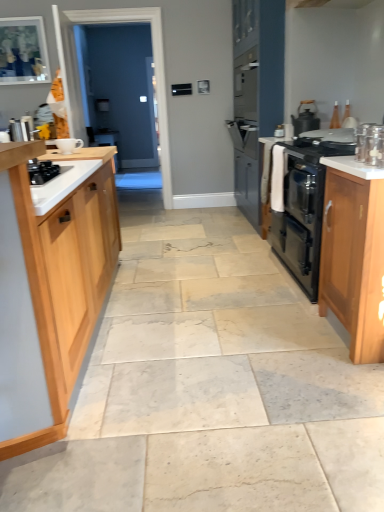
What do you see at coordinates (353, 167) in the screenshot? I see `white glossy countertop at right` at bounding box center [353, 167].

I want to click on white glossy countertop at right, so click(x=353, y=167).

The width and height of the screenshot is (384, 512). Identify the location of white ceramic cup at upper left, which appears as the first appliance when ordered from the bottom. (66, 145).

The width and height of the screenshot is (384, 512). Find the location of `black matte oven at right`. black matte oven at right is located at coordinates (334, 232).

Describe the element at coordinates (353, 256) in the screenshot. I see `light wood cabinet at right, which ranks as the 1th cabinetry in right-to-left order` at that location.

The width and height of the screenshot is (384, 512). In order to click on white glossy countertop at right in this screenshot , I will do `click(353, 167)`.

Is clear glass jar at upper right, marked as the first kitchen appliance in a front-to-back arrangement, facing towards light wood cabinet at right, which ranks as the 1th cabinetry in right-to-left order?

No, clear glass jar at upper right, marked as the first kitchen appliance in a front-to-back arrangement, is not aimed at light wood cabinet at right, which ranks as the 1th cabinetry in right-to-left order.

Does clear glass jar at upper right, which is the 2th kitchen appliance in top-to-bottom order, have a smaller size compared to light wood cabinet at right, marked as the second cabinetry in a left-to-right arrangement?

Indeed, clear glass jar at upper right, which is the 2th kitchen appliance in top-to-bottom order, has a smaller size compared to light wood cabinet at right, marked as the second cabinetry in a left-to-right arrangement.

The image size is (384, 512). What are the coordinates of `the 1st cabinetry in front of the clear glass jar at upper right, acting as the second kitchen appliance starting from the back, counting from the anchor's position` in the screenshot? It's located at (353, 256).

How much distance is there between clear glass jar at upper right, acting as the second kitchen appliance starting from the back, and light wood cabinet at right, which ranks as the 1th cabinetry in right-to-left order?

clear glass jar at upper right, acting as the second kitchen appliance starting from the back, is 15.69 inches from light wood cabinet at right, which ranks as the 1th cabinetry in right-to-left order.

Is point (92, 26) closer or farther from the camera than point (61, 144)?

Point (92, 26) is farther from the camera than point (61, 144).

You are a GUI agent. You are given a task and a screenshot of the screen. Output one action in this format:
    pyautogui.click(x=<x>, y=<y>)
    Task: Click on the glass door that is behind the white ceramic cup at upper left, which appears as the first appliance when ordered from the bottom
    
    Given the screenshot: What is the action you would take?
    pyautogui.click(x=123, y=89)

Is transparent glass door at center positioned before white ceramic cup at upper left, placed as the first appliance when sorted from right to left?

No, transparent glass door at center is further to the viewer.

Is transparent glass door at center positioned far away from white ceramic cup at upper left, arranged as the 1th appliance when viewed from the front?

transparent glass door at center is positioned a significant distance from white ceramic cup at upper left, arranged as the 1th appliance when viewed from the front.

From the image's perspective, does light wood cabinet at left, which is the 1th cabinetry in left-to-right order, appear higher than white ceramic cup at upper left, the 2th appliance from the top?

Actually, light wood cabinet at left, which is the 1th cabinetry in left-to-right order, appears below white ceramic cup at upper left, the 2th appliance from the top, in the image.

Can you tell me how much light wood cabinet at left, placed as the 2th cabinetry when sorted from right to left, and white ceramic cup at upper left, which appears as the first appliance when ordered from the bottom, differ in facing direction?

They differ by 86.9 degrees in their facing directions.

Considering the relative sizes of light wood cabinet at left, which is the 1th cabinetry in left-to-right order, and white ceramic cup at upper left, arranged as the 1th appliance when viewed from the front, in the image provided, is light wood cabinet at left, which is the 1th cabinetry in left-to-right order, thinner than white ceramic cup at upper left, arranged as the 1th appliance when viewed from the front,?

No.

From the image's perspective, starting from the white ceramic cup at upper left, which appears as the first appliance when ordered from the bottom, which cabinetry is the 1st one below? Please provide its 2D coordinates.

[(51, 286)]

Is metallic silver kettle at left, which is counted as the first appliance, starting from the top, facing away from light wood cabinet at right, which ranks as the 1th cabinetry in right-to-left order?

That's not correct — metallic silver kettle at left, which is counted as the first appliance, starting from the top, is not looking away from light wood cabinet at right, which ranks as the 1th cabinetry in right-to-left order.

Between metallic silver kettle at left, which ranks as the second appliance in right-to-left order, and light wood cabinet at right, which ranks as the 1th cabinetry in right-to-left order, which one appears on the left side from the viewer's perspective?

metallic silver kettle at left, which ranks as the second appliance in right-to-left order, is more to the left.

Locate an element on the screen. Image resolution: width=384 pixels, height=512 pixels. the 2nd appliance above the light wood cabinet at right, which ranks as the 1th cabinetry in right-to-left order (from the image's perspective) is located at coordinates (27, 127).

Based on the photo, from a real-world perspective, is metallic silver kettle at left, placed as the second appliance when sorted from bottom to top, positioned under light wood cabinet at right, which ranks as the 1th cabinetry in right-to-left order, based on gravity?

No, from a real-world perspective, metallic silver kettle at left, placed as the second appliance when sorted from bottom to top, is not under light wood cabinet at right, which ranks as the 1th cabinetry in right-to-left order.

Is light wood cabinet at right, which ranks as the 1th cabinetry in right-to-left order, behind metallic silver kettle at left, the second appliance from the front?

No.

From the image's perspective, between light wood cabinet at right, marked as the second cabinetry in a left-to-right arrangement, and metallic silver kettle at left, which is counted as the first appliance, starting from the top, which one is located above?

metallic silver kettle at left, which is counted as the first appliance, starting from the top, is shown above in the image.

Is light wood cabinet at right, marked as the second cabinetry in a left-to-right arrangement, at the left side of metallic silver kettle at left, the second appliance from the front?

No, light wood cabinet at right, marked as the second cabinetry in a left-to-right arrangement, is not to the left of metallic silver kettle at left, the second appliance from the front.

Who is smaller, light wood cabinet at right, marked as the second cabinetry in a left-to-right arrangement, or metallic silver kettle at left, placed as the second appliance when sorted from bottom to top?

metallic silver kettle at left, placed as the second appliance when sorted from bottom to top, is smaller.

In terms of size, does light wood cabinet at right, which ranks as the 1th cabinetry in right-to-left order, appear bigger or smaller than white glossy countertop at right?

Clearly, light wood cabinet at right, which ranks as the 1th cabinetry in right-to-left order, is larger in size than white glossy countertop at right.

Considering the relative sizes of light wood cabinet at right, which ranks as the 1th cabinetry in right-to-left order, and white glossy countertop at right in the image provided, is light wood cabinet at right, which ranks as the 1th cabinetry in right-to-left order, thinner than white glossy countertop at right?

Incorrect, the width of light wood cabinet at right, which ranks as the 1th cabinetry in right-to-left order, is not less than that of white glossy countertop at right.

How different are the orientations of light wood cabinet at right, which ranks as the 1th cabinetry in right-to-left order, and white glossy countertop at right in degrees?

light wood cabinet at right, which ranks as the 1th cabinetry in right-to-left order, and white glossy countertop at right are facing 6.46e-05 degrees away from each other.

From the image's perspective, is light wood cabinet at right, marked as the second cabinetry in a left-to-right arrangement, below white glossy countertop at right?

Yes, from the image's perspective, light wood cabinet at right, marked as the second cabinetry in a left-to-right arrangement, is below white glossy countertop at right.

Based on the photo, is black matte gas stove at left facing towards white ceramic cup at upper left, which ranks as the second appliance in left-to-right order?

No, black matte gas stove at left does not turn towards white ceramic cup at upper left, which ranks as the second appliance in left-to-right order.

You are a GUI agent. You are given a task and a screenshot of the screen. Output one action in this format:
    pyautogui.click(x=<x>, y=<y>)
    Task: Click on the appliance that is the 1st object to the left of the black matte gas stove at left, starting at the anchor
    
    Given the screenshot: What is the action you would take?
    pyautogui.click(x=66, y=145)

What's the angular difference between black matte gas stove at left and white ceramic cup at upper left, which appears as the first appliance when ordered from the bottom,'s facing directions?

3.26 degrees separate the facing orientations of black matte gas stove at left and white ceramic cup at upper left, which appears as the first appliance when ordered from the bottom.

From the image's perspective, which one is positioned lower, black matte gas stove at left or white ceramic cup at upper left, the 2th appliance from the top?

black matte gas stove at left is shown below in the image.

From the image's perspective, count 1st kitchen appliances upward from the light wood cabinet at right, which ranks as the 1th cabinetry in right-to-left order, and point to it. Please provide its 2D coordinates.

[(370, 145)]

Locate an element on the screen. This screenshot has width=384, height=512. glass door behind the white ceramic cup at upper left, which appears as the first appliance when ordered from the bottom is located at coordinates (123, 89).

Based on their spatial positions, is black matte oven at right or light wood cabinet at left, placed as the 2th cabinetry when sorted from right to left, further from light wood cabinet at right, which ranks as the 1th cabinetry in right-to-left order?

light wood cabinet at left, placed as the 2th cabinetry when sorted from right to left.

From the image, which object appears to be nearer to metallic silver kettle at left, which ranks as the second appliance in right-to-left order, white ceramic cup at upper left, which ranks as the second appliance in left-to-right order, or black matte oven at right?

The object closer to metallic silver kettle at left, which ranks as the second appliance in right-to-left order, is white ceramic cup at upper left, which ranks as the second appliance in left-to-right order.

Estimate the real-world distances between objects in this image. Which object is further from matte black kettle at upper right, the 2th kitchen appliance from the front, white ceramic cup at upper left, which appears as the first appliance when ordered from the bottom, or transparent glass door at center?

The object further to matte black kettle at upper right, the 2th kitchen appliance from the front, is transparent glass door at center.

Estimate the real-world distances between objects in this image. Which object is closer to white ceramic cup at upper left, placed as the first appliance when sorted from right to left, metallic silver kettle at left, the second appliance from the front, or white glossy countertop at right?

white glossy countertop at right is closer to white ceramic cup at upper left, placed as the first appliance when sorted from right to left.

Which object lies further to the anchor point metallic silver kettle at left, which is counted as the first appliance, starting from the top, transparent glass door at center or matte black kettle at upper right, acting as the second kitchen appliance starting from the bottom?

Based on the image, matte black kettle at upper right, acting as the second kitchen appliance starting from the bottom, appears to be further to metallic silver kettle at left, which is counted as the first appliance, starting from the top.

From the image, which object appears to be farther from black matte gas stove at left, matte black kettle at upper right, which is the 1th kitchen appliance from top to bottom, or clear glass jar at upper right, marked as the first kitchen appliance in a front-to-back arrangement?

The object further to black matte gas stove at left is matte black kettle at upper right, which is the 1th kitchen appliance from top to bottom.

Based on their spatial positions, is transparent glass door at center or white ceramic cup at upper left, the 2th appliance from the top, further from clear glass jar at upper right, the first kitchen appliance when ordered from bottom to top?

transparent glass door at center lies further to clear glass jar at upper right, the first kitchen appliance when ordered from bottom to top, than the other object.

Which object lies further to the anchor point clear glass jar at upper right, the first kitchen appliance when ordered from bottom to top, metallic silver kettle at left, which ranks as the second appliance in right-to-left order, or black matte oven at right?

metallic silver kettle at left, which ranks as the second appliance in right-to-left order.

I want to click on counter between light wood cabinet at left, which is the 1th cabinetry in left-to-right order, and transparent glass door at center in the front-back direction, so click(334, 232).

Where is `appliance between clear glass jar at upper right, the first kitchen appliance when ordered from bottom to top, and transparent glass door at center, along the z-axis`? appliance between clear glass jar at upper right, the first kitchen appliance when ordered from bottom to top, and transparent glass door at center, along the z-axis is located at coordinates (66, 145).

In order to click on counter positioned between light wood cabinet at left, which is the 1th cabinetry in left-to-right order, and white ceramic cup at upper left, the 2th appliance from the top, from near to far in this screenshot , I will do `click(334, 232)`.

Where is `kitchen appliance located between white ceramic cup at upper left, which appears as the first appliance when ordered from the bottom, and white glossy countertop at right in the left-right direction`? The width and height of the screenshot is (384, 512). kitchen appliance located between white ceramic cup at upper left, which appears as the first appliance when ordered from the bottom, and white glossy countertop at right in the left-right direction is located at coordinates (370, 145).